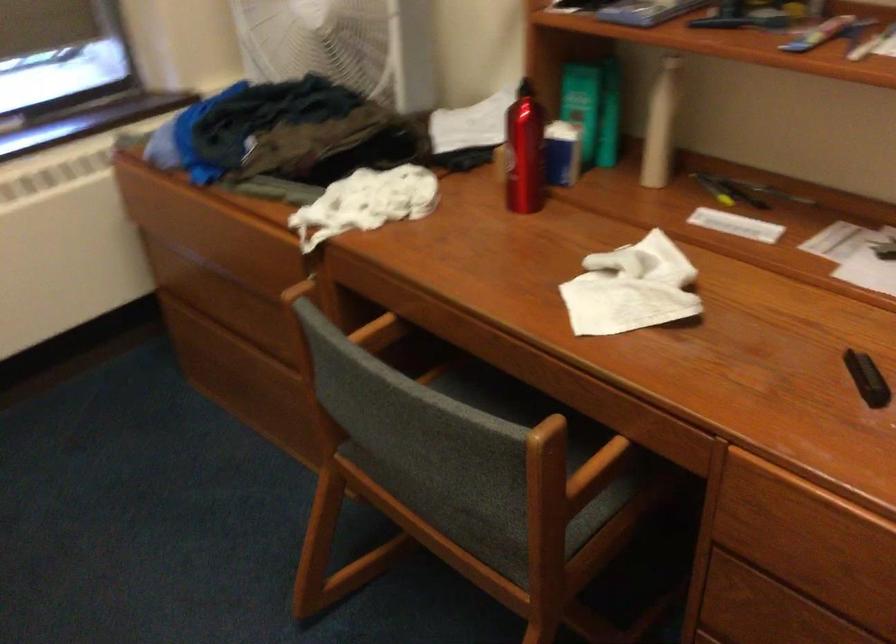
Find the location of `chair sitting surface`. chair sitting surface is located at coordinates (488, 509).